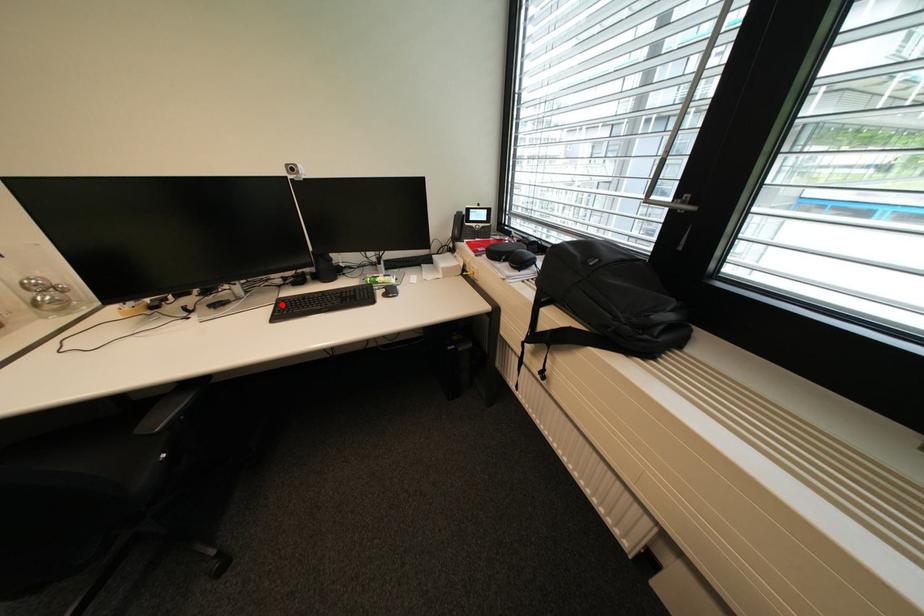
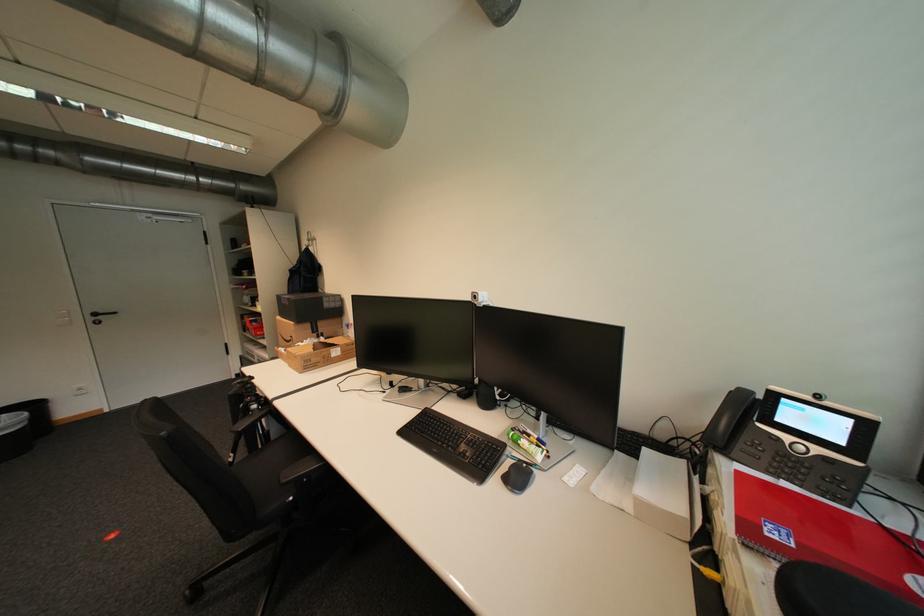
In the second image, find the point that corresponds to the highlighted location in the first image.

(430, 411)